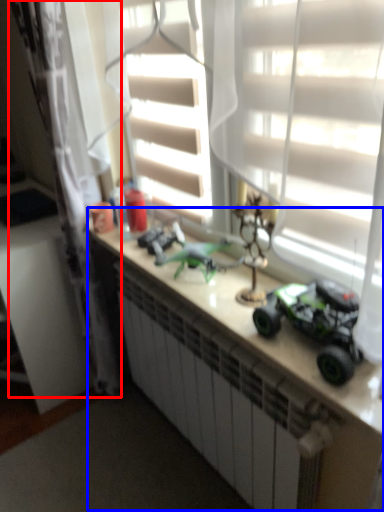
Question: Which object appears closest to the camera in this image, curtain (highlighted by a red box) or counter (highlighted by a blue box)?

Choices:
 (A) curtain
 (B) counter

Answer: (B)